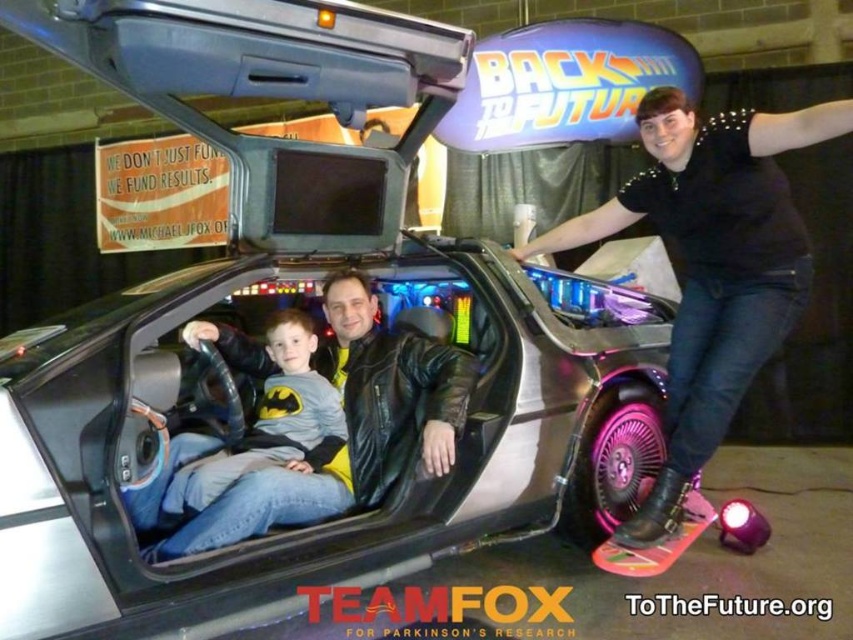
You are taking a photo of the DeLorean time machine and want to focus on both the point at coordinates point (695,440) and point (312,472). Which point is closer to the camera?

Point (312,472) is closer to the camera than point (695,440).